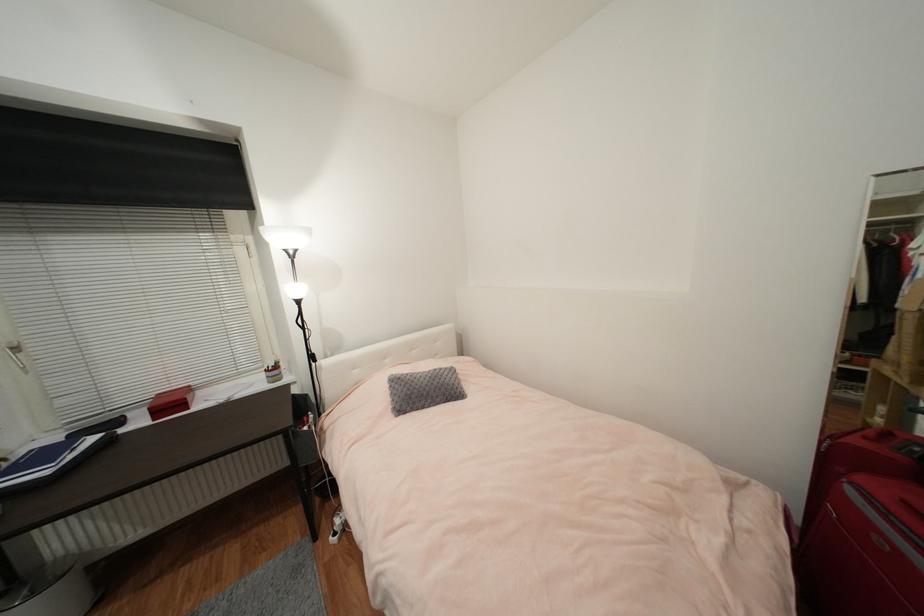
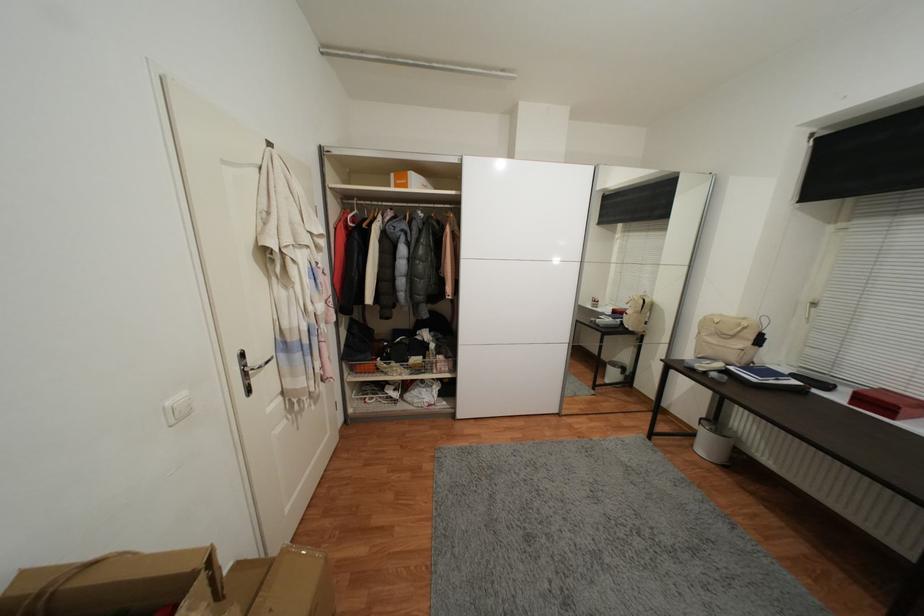
Where in the second image is the point corresponding to the point at 122,424 from the first image?

(831, 387)